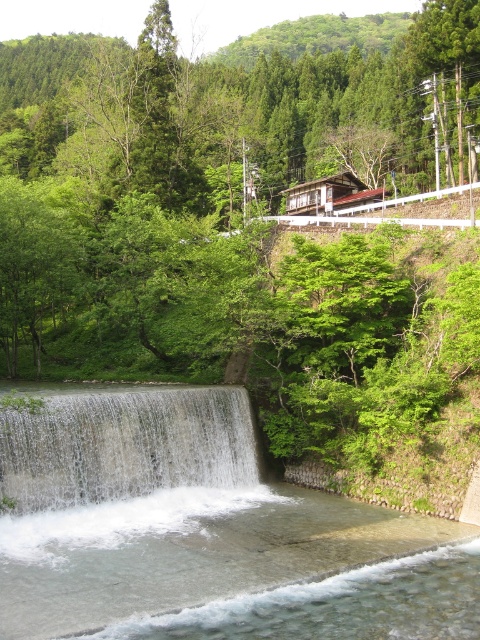
You are standing at the origin point of the image. Where is the clear water at center located in terms of coordinates?

The clear water at center is located at coordinates point (204, 532).

You are standing at the base of the waterfall in the image and want to take a photo of both the point at coordinates point [277,516] and point [19,403]. Which point should you focus on first to ensure both are in clear view?

You should focus on point [277,516] first because it is closer to you than point [19,403], ensuring both points are in focus when using a camera with a fixed focal plane.